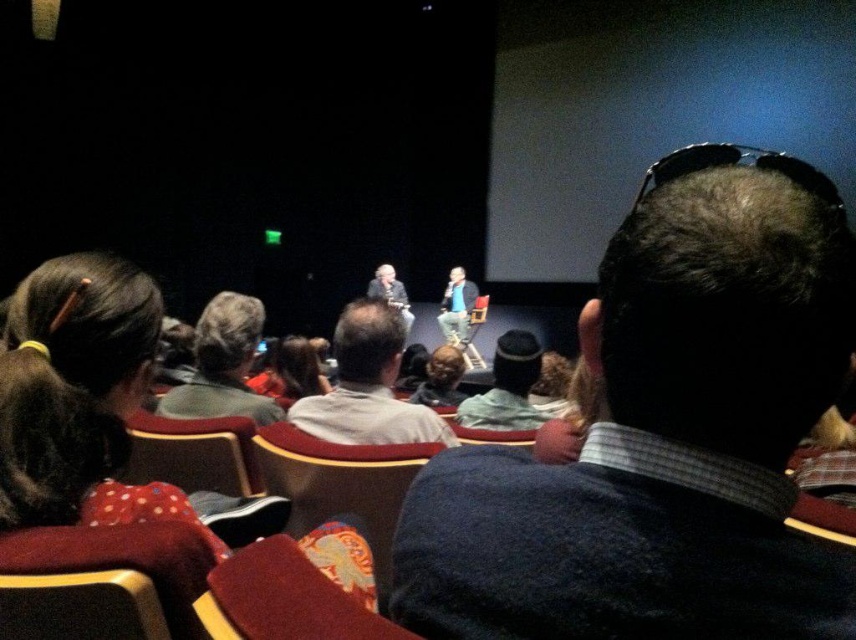
Does gray fabric shirt at center appear over dark gray suit at center?

Incorrect, gray fabric shirt at center is not positioned above dark gray suit at center.

Which of these two, gray fabric shirt at center or dark gray suit at center, stands shorter?

gray fabric shirt at center

Is point (444, 435) farther from viewer compared to point (400, 282)?

No, it is not.

Find the location of a particular element. gray fabric shirt at center is located at coordinates (367, 387).

Locate an element on the screen. The width and height of the screenshot is (856, 640). velvet red chair at lower left is located at coordinates (80, 605).

Is velvet red chair at lower left closer to camera compared to gray wool sweater at center?

Yes, it is in front of gray wool sweater at center.

What do you see at coordinates (80, 605) in the screenshot? This screenshot has height=640, width=856. I see `velvet red chair at lower left` at bounding box center [80, 605].

Where is `velvet red chair at lower left`? velvet red chair at lower left is located at coordinates (80, 605).

Does gray wool sweater at center lie in front of dark brown hair at center?

That is True.

The height and width of the screenshot is (640, 856). I want to click on gray wool sweater at center, so click(223, 364).

Where is `gray wool sweater at center`? gray wool sweater at center is located at coordinates (223, 364).